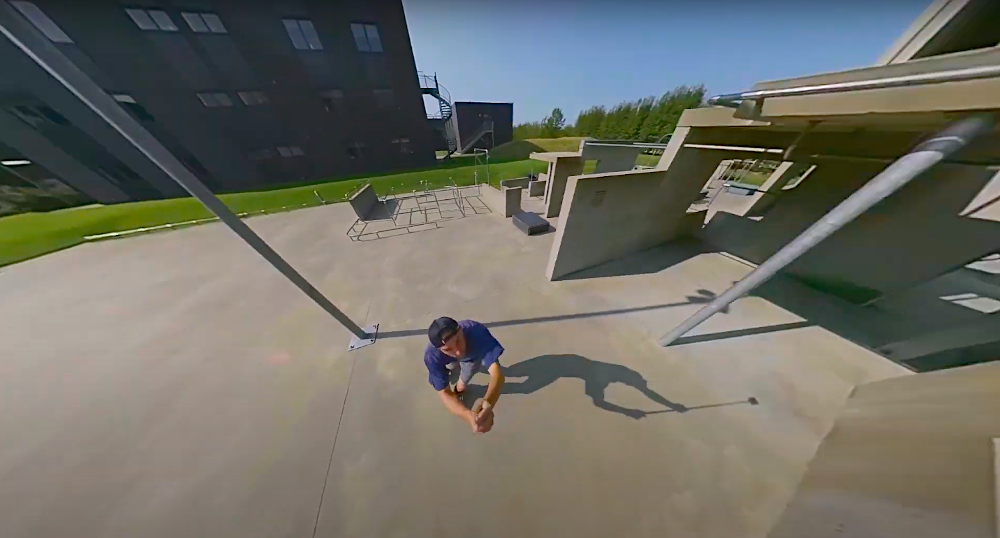
Where is `windows`? windows is located at coordinates (156, 19), (202, 24), (303, 36), (366, 44), (253, 96), (215, 101), (288, 152).